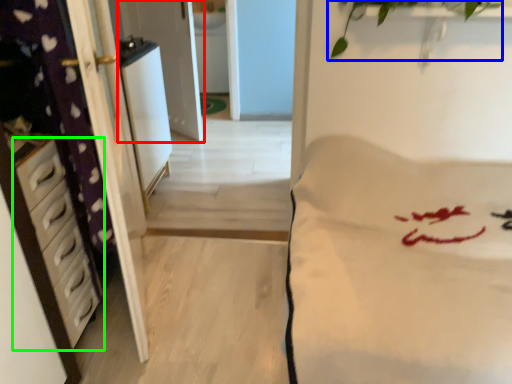
Question: Estimate the real-world distances between objects in this image. Which object is closer to screen door (highlighted by a red box), plant (highlighted by a blue box) or chest of drawers (highlighted by a green box)?

Choices:
 (A) plant
 (B) chest of drawers

Answer: (A)